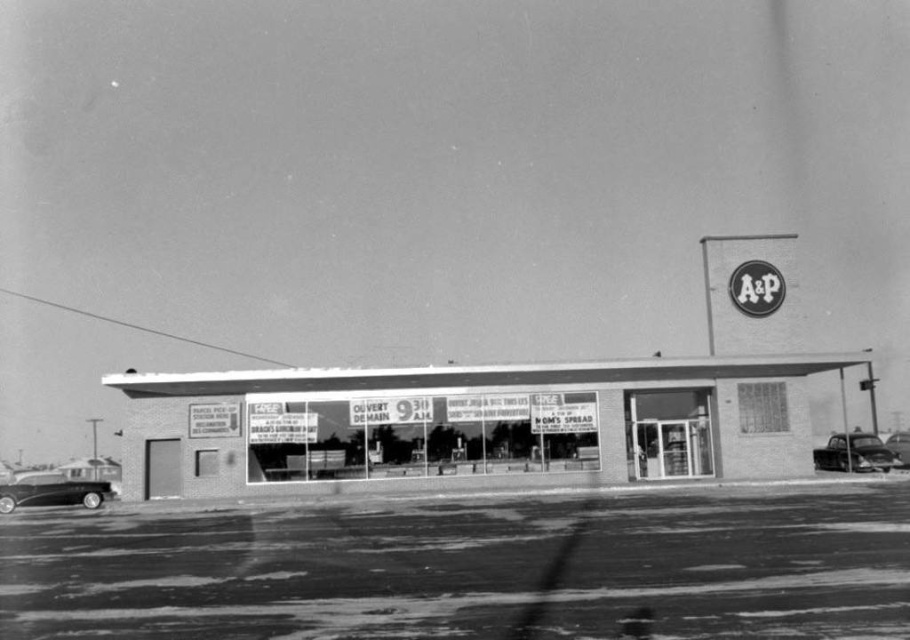
You are standing in front of the vintage A amp amp supermarket and notice two points marked on the window. The first point is at coordinates point (858, 461) and the second is at point (888, 435). From your perspective, which point appears closer to you?

Point (858, 461) is in front of point (888, 435), so it appears closer to you.

From the picture: You are a delivery driver who needs to park your truck between the shiny black car at lower right and the shiny black car at right. The truck is 3 meters long. Can you safely park your truck there without overlapping either car?

The distance between the shiny black car at lower right and the shiny black car at right is 2.47 meters. Since the truck is 3 meters long, it cannot fit in the space between them without overlapping either car.

Consider the image. You are a delivery driver who needs to park your truck between the two shiny black cars. The truck is 10 meters long. Is there enough space between the shiny black car at lower left and the shiny black car at lower right for your truck?

The distance between the shiny black car at lower left and the shiny black car at lower right is 34.12 meters. Since the truck is only 10 meters long, there is sufficient space to park between them.